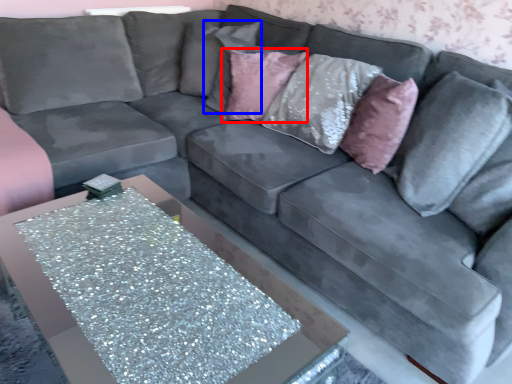
Question: Which point is closer to the camera, pillow (highlighted by a red box) or pillow (highlighted by a blue box)?

Choices:
 (A) pillow
 (B) pillow

Answer: (A)